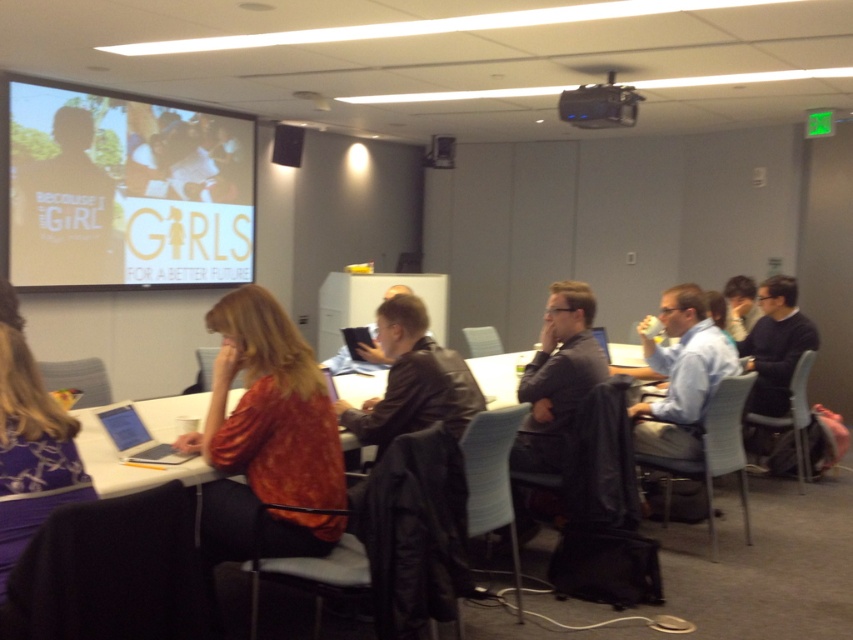
Does black plastic projector at upper center appear under matte black speaker at upper center?

Yes, black plastic projector at upper center is below matte black speaker at upper center.

What do you see at coordinates (599, 106) in the screenshot? I see `black plastic projector at upper center` at bounding box center [599, 106].

The width and height of the screenshot is (853, 640). What are the coordinates of `black plastic projector at upper center` in the screenshot? It's located at [599, 106].

Between orange textured shirt at center and matte blue shirt at right, which one has less height?

matte blue shirt at right is shorter.

Is point (219, 428) closer to viewer compared to point (692, 355)?

Yes, point (219, 428) is in front of point (692, 355).

Where is `orange textured shirt at center`? The width and height of the screenshot is (853, 640). orange textured shirt at center is located at coordinates (263, 424).

Which is more to the left, matte white projector screen at upper left or leather jacket at center?

matte white projector screen at upper left is more to the left.

Between matte white projector screen at upper left and leather jacket at center, which one has more height?

matte white projector screen at upper left

Describe the element at coordinates (126, 189) in the screenshot. I see `matte white projector screen at upper left` at that location.

This screenshot has height=640, width=853. In order to click on matte white projector screen at upper left in this screenshot , I will do `click(126, 189)`.